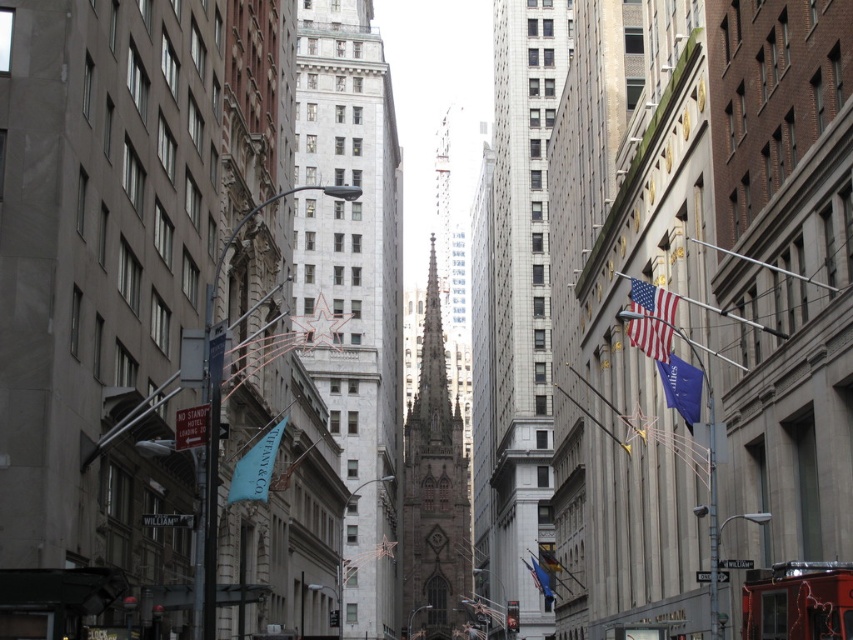
You are standing on the street and see the gray stone tower at center and the blue fabric flag at lower left. Which object is located to the right of the other?

The gray stone tower at center is positioned on the right side of blue fabric flag at lower left, so the gray stone tower at center is to the right of the blue fabric flag at lower left.

You are a city planner assessing the urban skyline. You need to determine which object, the white tiled tower at center or the blue fabric flag at lower center, would cast a longer shadow during midday. Based on their positions in the scene, which one do you think it would be?

The white tiled tower at center is taller than the blue fabric flag at lower center, so it would cast a longer shadow during midday.

You are standing on the street looking up at the scene. Which object is positioned to the right of the other between the white tiled tower at center and the blue fabric flag at lower left?

The white tiled tower at center is positioned to the right of the blue fabric flag at lower left.